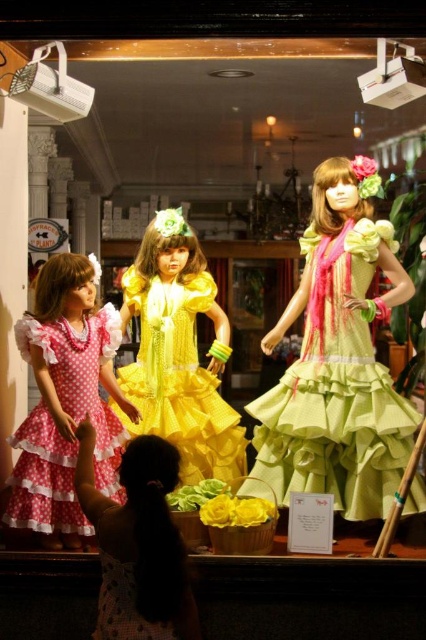
Does green satin dress at center have a smaller size compared to pink polka dot fabric dress at left?

No, green satin dress at center is not smaller than pink polka dot fabric dress at left.

Is point (250, 406) positioned behind point (80, 378)?

Yes, it is.

Locate an element on the screen. This screenshot has height=640, width=426. green satin dress at center is located at coordinates (333, 422).

Measure the distance between dotted fabric dress at lower left and pink polka dot dress at lower left.

dotted fabric dress at lower left is 4.09 inches away from pink polka dot dress at lower left.

Is dotted fabric dress at lower left behind pink polka dot dress at lower left?

Yes, it is.

Identify the location of dotted fabric dress at lower left. The height and width of the screenshot is (640, 426). (141, 528).

Does yellow satin dress at center appear on the right side of pink polka dot dress at lower left?

Correct, you'll find yellow satin dress at center to the right of pink polka dot dress at lower left.

Between point (164, 376) and point (180, 596), which one is positioned in front?

Point (180, 596) is in front.

Which is behind, point (210, 413) or point (118, 554)?

The point (210, 413) is behind.

The width and height of the screenshot is (426, 640). Find the location of `yellow satin dress at center`. yellow satin dress at center is located at coordinates (178, 378).